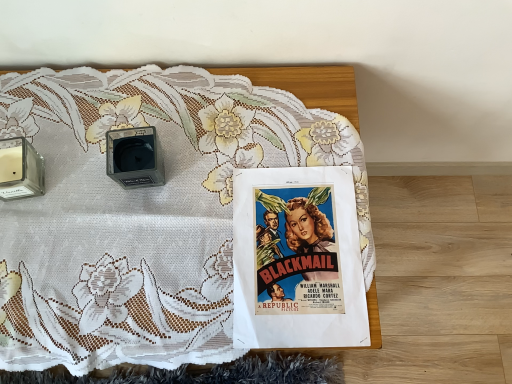
Where is `free space in front of matte black speaker at center, positioned as the 2th speaker in left-to-right order`? This screenshot has width=512, height=384. free space in front of matte black speaker at center, positioned as the 2th speaker in left-to-right order is located at coordinates (130, 257).